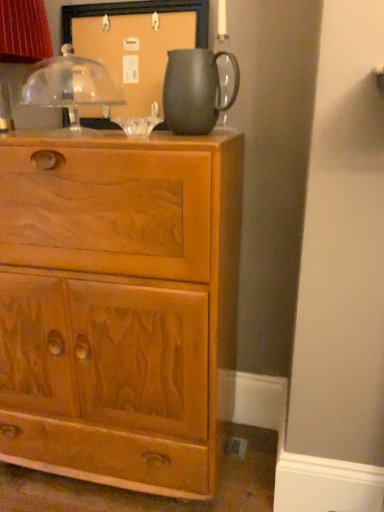
Question: From the image's perspective, is light brown wood chest of drawers at center above or below matte black pitcher at upper center?

Choices:
 (A) above
 (B) below

Answer: (B)

Question: Considering the positions of light brown wood chest of drawers at center and matte black pitcher at upper center in the image, is light brown wood chest of drawers at center taller or shorter than matte black pitcher at upper center?

Choices:
 (A) short
 (B) tall

Answer: (B)

Question: Based on their relative distances, which object is farther from the matte black pitcher at upper center?

Choices:
 (A) light brown wood chest of drawers at center
 (B) matte black pitcher at upper center

Answer: (A)

Question: Which object is the closest to the matte black pitcher at upper center?

Choices:
 (A) matte black pitcher at upper center
 (B) light brown wood chest of drawers at center

Answer: (A)